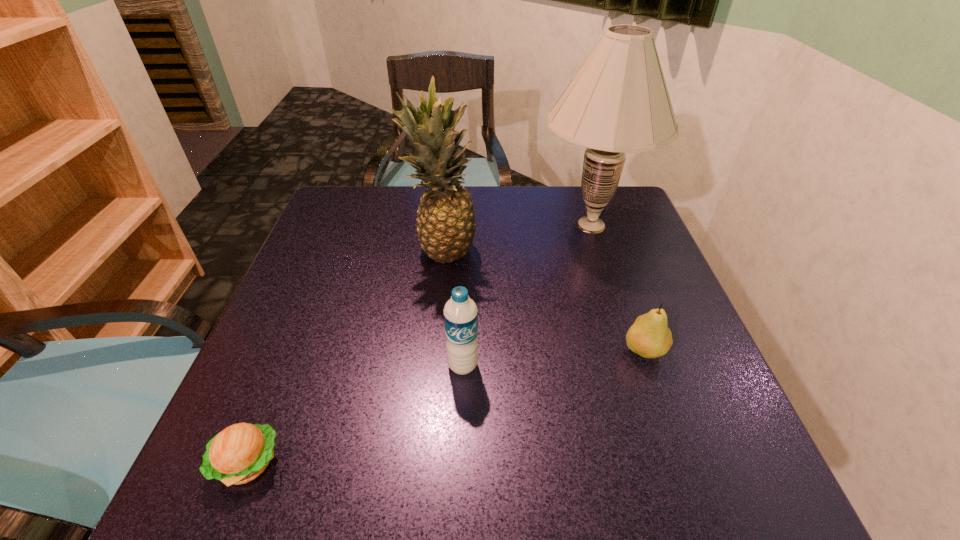
Find the location of `lampshade`. lampshade is located at coordinates (618, 102).

Image resolution: width=960 pixels, height=540 pixels. What are the coordinates of `the second tallest object` in the screenshot? It's located at (446, 225).

You are a GUI agent. You are given a task and a screenshot of the screen. Output one action in this format:
    pyautogui.click(x=<x>, y=<y>)
    Task: Click on the third shortest object
    
    Given the screenshot: What is the action you would take?
    pyautogui.click(x=460, y=312)

The height and width of the screenshot is (540, 960). Identify the location of pear. (649, 336).

In order to click on hamburger in this screenshot , I will do `click(238, 454)`.

I want to click on the shortest object, so click(238, 454).

The height and width of the screenshot is (540, 960). What are the coordinates of `free space located on the left of the lampshade` in the screenshot? It's located at (492, 225).

Where is `free location located 0.090m on the back of the pineapple`? free location located 0.090m on the back of the pineapple is located at coordinates [x=446, y=212].

Where is `free space located 0.210m on the label of the water bottle`? The height and width of the screenshot is (540, 960). free space located 0.210m on the label of the water bottle is located at coordinates (458, 497).

At what (x,y) coordinates should I click in order to perform the action: click on vacant space located on the left of the pear. Please return your answer as a coordinate pair (x, y). Looking at the image, I should click on (565, 350).